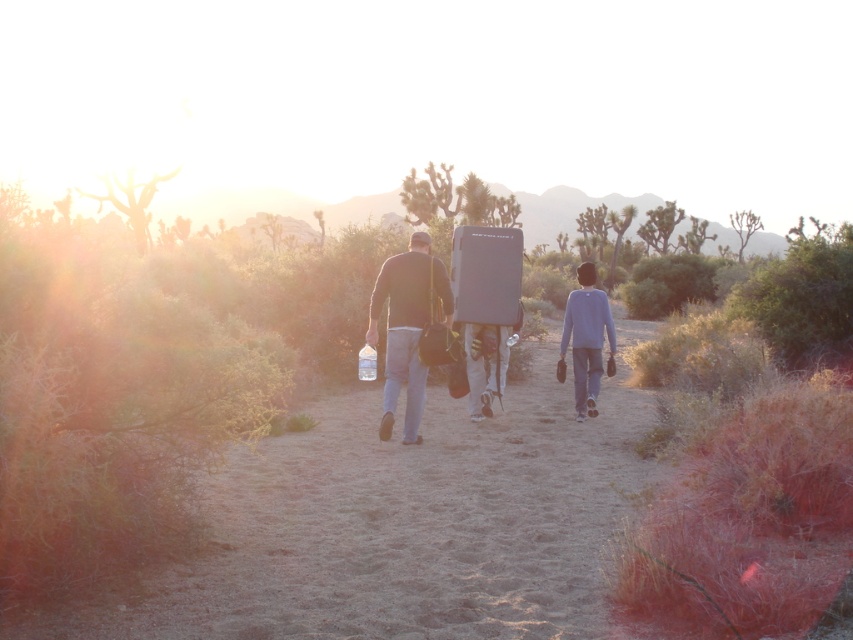
Between point (503, 483) and point (403, 426), which one is positioned behind?

Positioned behind is point (403, 426).

Which is above, brown sand at center or matte black backpack at center?

matte black backpack at center is above.

Which is behind, point (502, 592) or point (405, 296)?

Point (405, 296)

At what (x,y) coordinates should I click in order to perform the action: click on brown sand at center. Please return your answer as a coordinate pair (x, y). The image size is (853, 640). Looking at the image, I should click on pyautogui.click(x=403, y=524).

Who is more forward, (450, 506) or (590, 349)?

Point (450, 506) is more forward.

Does brown sand at center have a larger size compared to gray cotton shirt at center?

Yes, brown sand at center is bigger than gray cotton shirt at center.

At what (x,y) coordinates should I click in order to perform the action: click on brown sand at center. Please return your answer as a coordinate pair (x, y). Looking at the image, I should click on (403, 524).

Which is above, matte black backpack at center or gray cotton shirt at center?

Positioned higher is matte black backpack at center.

Between matte black backpack at center and gray cotton shirt at center, which one is positioned lower?

Positioned lower is gray cotton shirt at center.

Measure the distance between point (410, 324) and camera.

Point (410, 324) and camera are 7.43 meters apart from each other.

Find the location of a particular element. The width and height of the screenshot is (853, 640). matte black backpack at center is located at coordinates (407, 326).